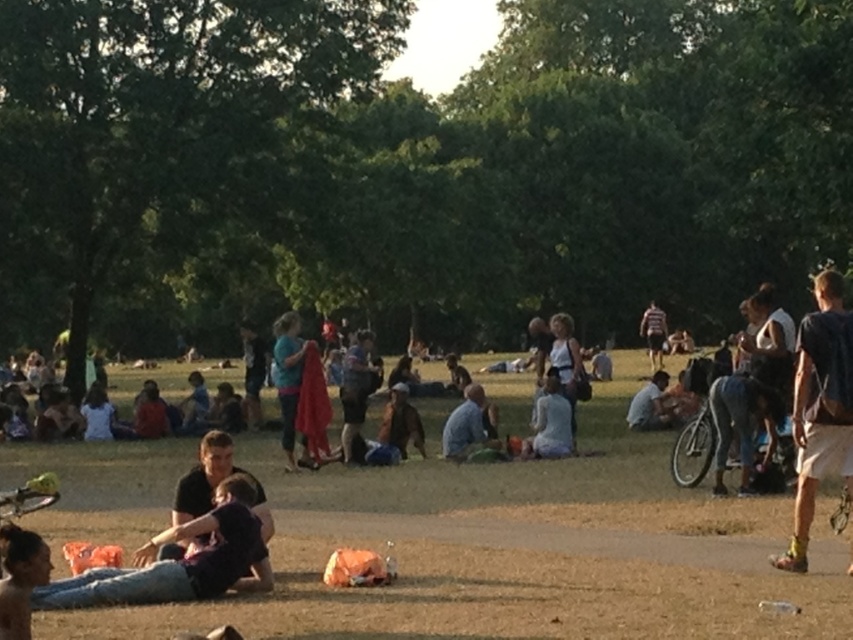
Who is positioned more to the right, dark brown hair at lower left or light blue fabric at center?

light blue fabric at center

Who is taller, dark brown hair at lower left or light blue fabric at center?

With more height is light blue fabric at center.

The width and height of the screenshot is (853, 640). Identify the location of dark brown hair at lower left. (20, 577).

At what (x,y) coordinates should I click in order to perform the action: click on dark brown hair at lower left. Please return your answer as a coordinate pair (x, y). The image size is (853, 640). Looking at the image, I should click on (20, 577).

Who is more distant from viewer, (212, 586) or (15, 605)?

Positioned behind is point (212, 586).

Is point (242, 560) more distant than point (45, 563)?

That is True.

The width and height of the screenshot is (853, 640). What are the coordinates of `dark blue shirt at lower left` in the screenshot? It's located at (178, 561).

Image resolution: width=853 pixels, height=640 pixels. In order to click on dark blue shirt at lower left in this screenshot , I will do `click(178, 561)`.

Can you confirm if blue fabric at center is positioned to the right of striped shirt at center?

No, blue fabric at center is not to the right of striped shirt at center.

Between blue fabric at center and striped shirt at center, which one appears on the right side from the viewer's perspective?

striped shirt at center is more to the right.

Image resolution: width=853 pixels, height=640 pixels. Find the location of `blue fabric at center`. blue fabric at center is located at coordinates (289, 381).